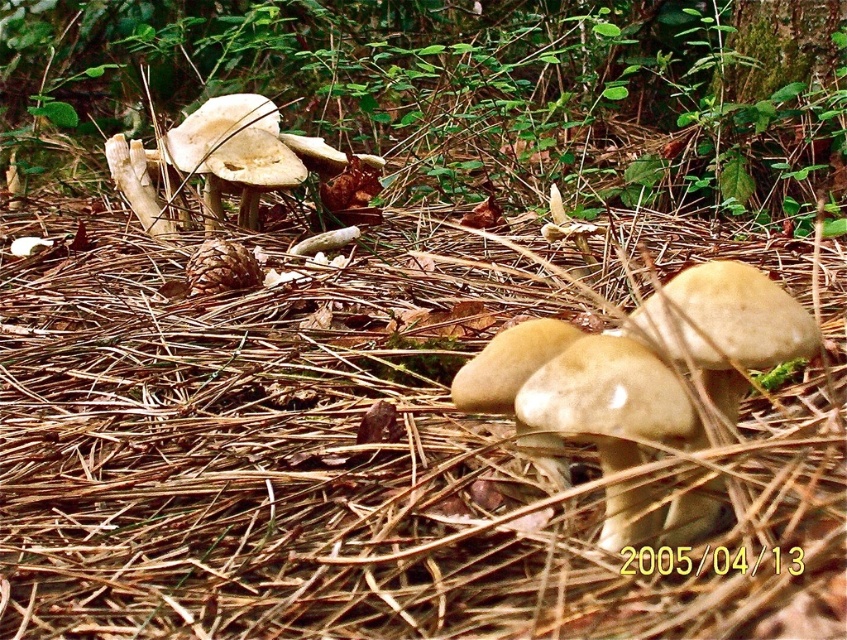
Question: Does white matte mushrooms at center have a lesser width compared to light brown mushroom at center?

Choices:
 (A) no
 (B) yes

Answer: (A)

Question: Which of the following is the farthest from the observer?

Choices:
 (A) (547, 68)
 (B) (558, 365)

Answer: (A)

Question: Which object appears closest to the camera in this image?

Choices:
 (A) light brown mushroom at center
 (B) white matte mushrooms at center

Answer: (A)

Question: Which object appears farthest from the camera in this image?

Choices:
 (A) white matte mushrooms at center
 (B) light brown mushroom at center

Answer: (A)

Question: Is white matte mushrooms at center closer to the viewer compared to light brown mushroom at center?

Choices:
 (A) no
 (B) yes

Answer: (A)

Question: Is white matte mushrooms at center smaller than light brown mushroom at center?

Choices:
 (A) no
 (B) yes

Answer: (A)